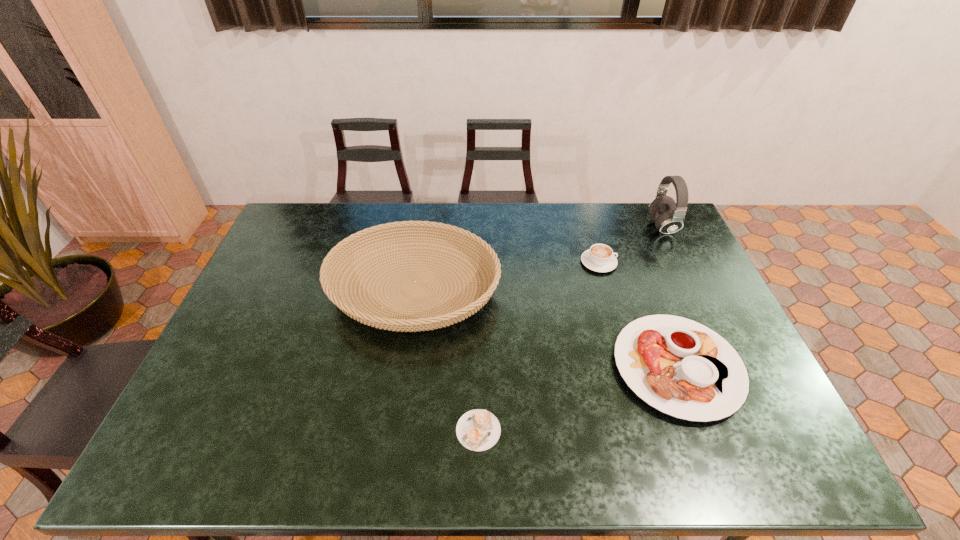
I want to click on free space located 0.060m on the ear cups of the headset, so click(632, 226).

Image resolution: width=960 pixels, height=540 pixels. In order to click on vacant space located 0.100m on the back of the fourth shortest object in this screenshot , I will do `click(423, 227)`.

This screenshot has height=540, width=960. I want to click on vacant region located on the side of the taller cappuccino with the handle, so click(x=679, y=262).

I want to click on vacant space located on the back of the fourth tallest object, so click(637, 262).

Where is `free location located 0.330m on the back of the nearer cappuccino`? free location located 0.330m on the back of the nearer cappuccino is located at coordinates (479, 310).

In order to click on object that is at the far edge in this screenshot , I will do `click(669, 217)`.

This screenshot has width=960, height=540. I want to click on object located in the near edge section of the desktop, so click(478, 430).

Locate an element on the screen. The image size is (960, 540). headset situated at the right edge is located at coordinates (669, 217).

Where is `platter positioned at the right edge`? Image resolution: width=960 pixels, height=540 pixels. platter positioned at the right edge is located at coordinates (682, 368).

You are a GUI agent. You are given a task and a screenshot of the screen. Output one action in this format:
    pyautogui.click(x=<x>, y=<y>)
    Task: Click on the object located at the far right corner
    The width and height of the screenshot is (960, 540).
    Given the screenshot: What is the action you would take?
    (669, 217)